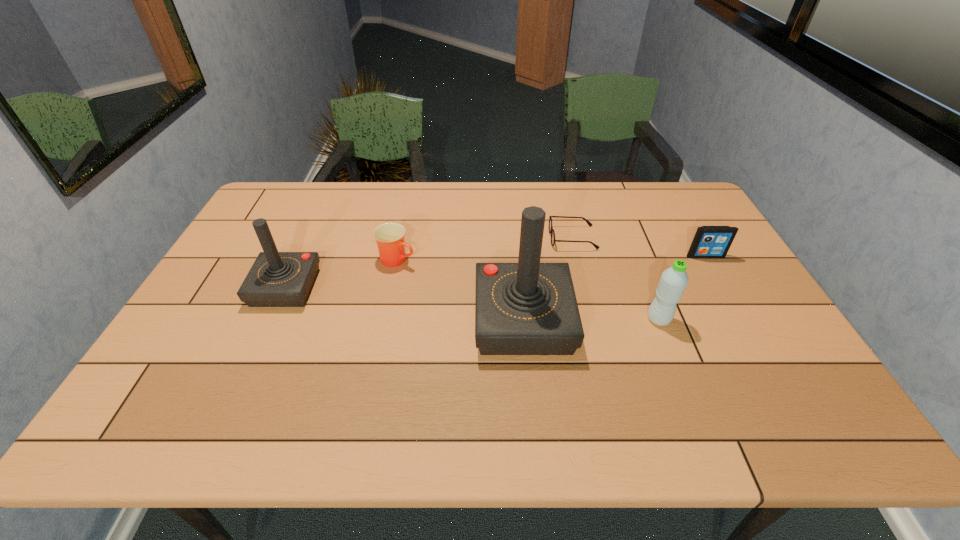
Locate which object is the second closest to the rightmost object. Please provide its 2D coordinates. Your answer should be formatted as a tuple, i.e. [(x, y)], where the tuple contains the x and y coordinates of a point satisfying the conditions above.

[(551, 230)]

Where is `the second closest object relative to the cup`? the second closest object relative to the cup is located at coordinates (527, 308).

At what (x,y) coordinates should I click in order to perform the action: click on free spot that satisfies the following two spatial constraints: 1. on the rectangular base of the second object from right to left; 2. on the right side of the leftmost object. Please return your answer as a coordinate pair (x, y). This screenshot has height=540, width=960. Looking at the image, I should click on (271, 319).

I want to click on vacant region that satisfies the following two spatial constraints: 1. on the back side of the fifth object from left to right; 2. on the front-facing side of the spectacles, so click(627, 238).

Find the location of `free space that satisfies the following two spatial constraints: 1. on the front side of the second object from left to right; 2. on the rectangular base of the shorter joystick`. free space that satisfies the following two spatial constraints: 1. on the front side of the second object from left to right; 2. on the rectangular base of the shorter joystick is located at coordinates (392, 287).

At what (x,y) coordinates should I click in order to perform the action: click on free space that satisfies the following two spatial constraints: 1. on the front-facing side of the water bottle; 2. on the left side of the shortest object. Please return your answer as a coordinate pair (x, y). The height and width of the screenshot is (540, 960). Looking at the image, I should click on (593, 319).

Locate an element on the screen. free space that satisfies the following two spatial constraints: 1. on the front-facing side of the spectacles; 2. on the rectangular base of the tallest object is located at coordinates (593, 320).

Locate an element on the screen. This screenshot has height=540, width=960. vacant space that satisfies the following two spatial constraints: 1. on the rectangular base of the third tallest object; 2. on the right side of the shorter joystick is located at coordinates (271, 319).

Locate an element on the screen. free space that satisfies the following two spatial constraints: 1. on the front-facing side of the shortest object; 2. on the left side of the second object from right to left is located at coordinates (593, 319).

Identify the location of free space that satisfies the following two spatial constraints: 1. on the front side of the third tallest object; 2. on the right side of the second object from left to right. (385, 319).